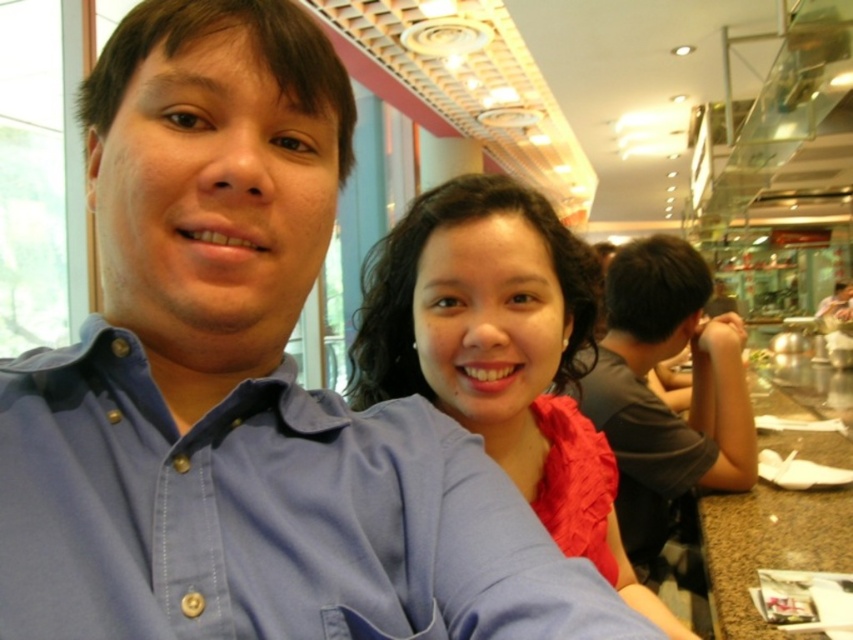
You are a photographer trying to capture the matte blue shirt at center in the image. The camera has a focus point at coordinate point (502, 353). Is the focus point correctly placed to capture the matte blue shirt at center?

Yes, the focus point at coordinate point (502, 353) is correctly placed to capture the matte blue shirt at center because the point indicates the location of the matte blue shirt at center.

You are a photographer trying to capture a closeup of the blue cotton shirt at center. The camera is currently focused on the point at coordinates point [264,515]. Is the blue cotton shirt at center in focus?

Yes, the blue cotton shirt at center is in focus because the camera is focused on the point [264,515], which indicates that the blue cotton shirt at center is at that coordinate.

You are standing in the dining area and want to find the blue cotton shirt at center. According to the coordinates given, in which direction should you look relative to the center of the image?

The blue cotton shirt at center is located at coordinates 0.806 on the x axis and 0.311 on the y axis. Since the x coordinate is greater than 0.5, it is to the right of center. The y coordinate is also greater than 0.5, so it is below the center. Therefore, you should look to the right and below the center of the image to find the blue cotton shirt at center.